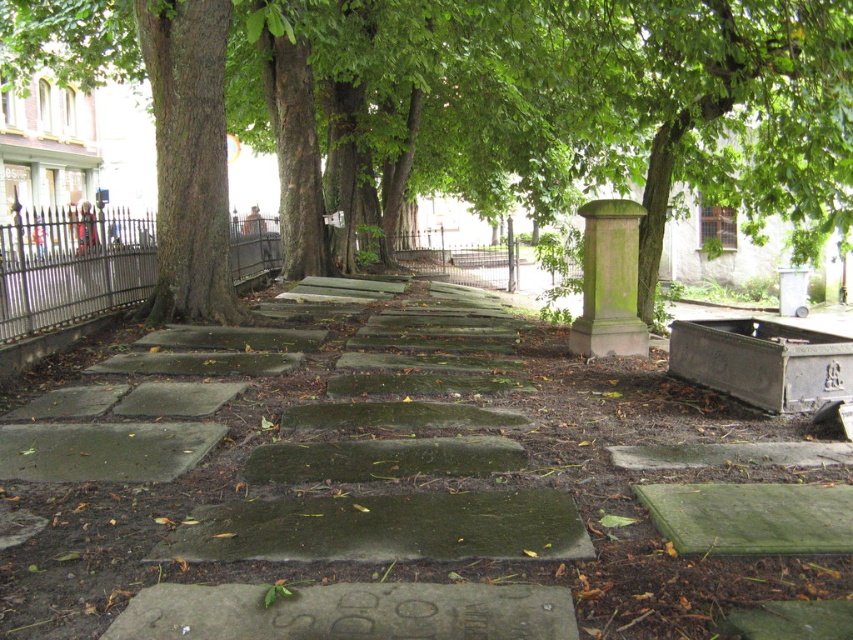
Question: Is green mossy stone at center wider than iron/grey metal fence at left?

Choices:
 (A) no
 (B) yes

Answer: (A)

Question: Among these objects, which one is nearest to the camera?

Choices:
 (A) green mossy stone pillar at center-right
 (B) green mossy tree at center

Answer: (B)

Question: Which of the following is the closest to the observer?

Choices:
 (A) green mossy tree at center
 (B) iron/grey metal fence at left

Answer: (A)

Question: Does green mossy stone at center appear on the right side of green mossy stone pillar at center-right?

Choices:
 (A) no
 (B) yes

Answer: (A)

Question: Is iron/grey metal fence at left to the right of green mossy stone pillar at center-right from the viewer's perspective?

Choices:
 (A) yes
 (B) no

Answer: (B)

Question: Which object is positioned farthest from the green mossy tree at center?

Choices:
 (A) iron/grey metal fence at left
 (B) green mossy stone at center

Answer: (B)